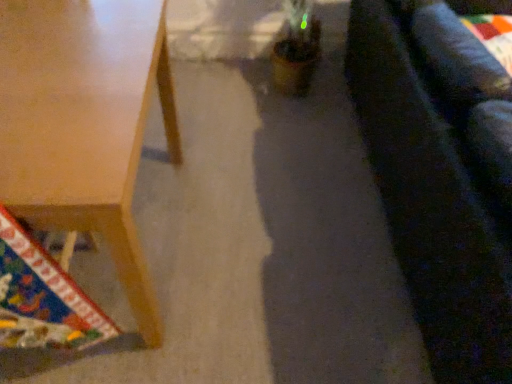
Question: Is light brown wooden table at lower left completely or partially inside dark blue fabric couch at right?

Choices:
 (A) yes
 (B) no

Answer: (B)

Question: Is dark blue fabric couch at right in front of light brown wooden table at lower left?

Choices:
 (A) yes
 (B) no

Answer: (A)

Question: Considering the relative positions of dark blue fabric couch at right and light brown wooden table at lower left in the image provided, is dark blue fabric couch at right to the left of light brown wooden table at lower left from the viewer's perspective?

Choices:
 (A) no
 (B) yes

Answer: (A)

Question: Is dark blue fabric couch at right shorter than light brown wooden table at lower left?

Choices:
 (A) yes
 (B) no

Answer: (B)

Question: Is dark blue fabric couch at right to the right of light brown wooden table at lower left from the viewer's perspective?

Choices:
 (A) yes
 (B) no

Answer: (A)

Question: Considering the relative sizes of dark blue fabric couch at right and light brown wooden table at lower left in the image provided, is dark blue fabric couch at right thinner than light brown wooden table at lower left?

Choices:
 (A) no
 (B) yes

Answer: (A)

Question: Is dark blue fabric couch at right inside light brown wooden table at lower left?

Choices:
 (A) yes
 (B) no

Answer: (B)

Question: Does light brown wooden table at lower left appear on the right side of dark blue fabric couch at right?

Choices:
 (A) yes
 (B) no

Answer: (B)

Question: From the image's perspective, is light brown wooden table at lower left on dark blue fabric couch at right?

Choices:
 (A) no
 (B) yes

Answer: (A)

Question: Considering the relative sizes of light brown wooden table at lower left and dark blue fabric couch at right in the image provided, is light brown wooden table at lower left taller than dark blue fabric couch at right?

Choices:
 (A) no
 (B) yes

Answer: (A)

Question: Would you say light brown wooden table at lower left is outside dark blue fabric couch at right?

Choices:
 (A) yes
 (B) no

Answer: (A)

Question: From the image's perspective, is light brown wooden table at lower left beneath dark blue fabric couch at right?

Choices:
 (A) yes
 (B) no

Answer: (A)

Question: In terms of width, does dark blue fabric couch at right look wider or thinner when compared to light brown wooden table at lower left?

Choices:
 (A) wide
 (B) thin

Answer: (A)